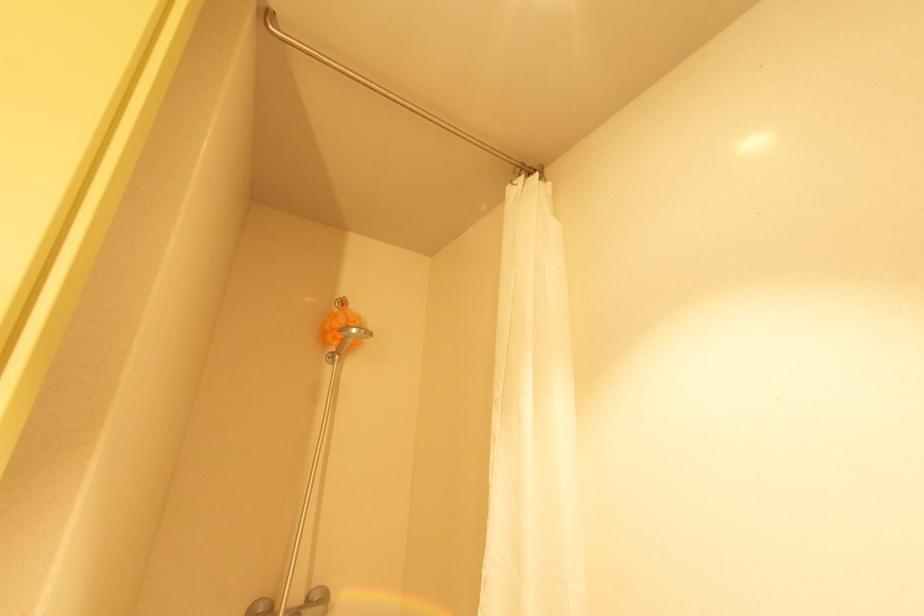
Identify the location of silver shower head. (349, 338).